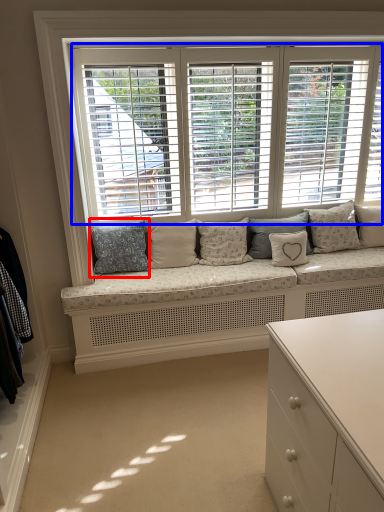
Question: Which object appears farthest to the camera in this image, pillow (highlighted by a red box) or window (highlighted by a blue box)?

Choices:
 (A) pillow
 (B) window

Answer: (A)